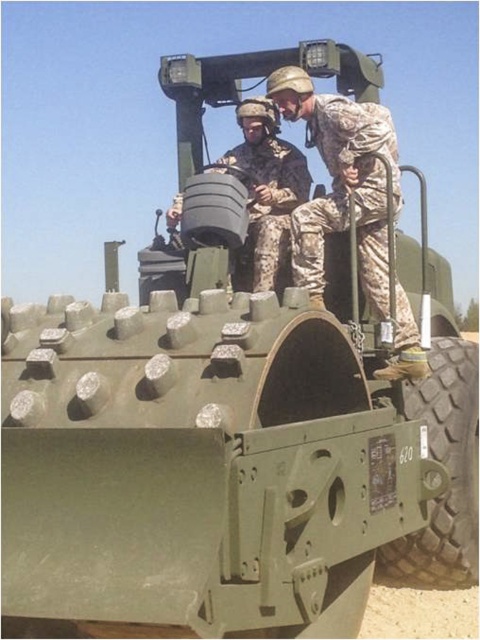
Question: Which object appears farthest from the camera in this image?

Choices:
 (A) camouflage fabric uniform at center
 (B) rubber tread tire at lower right
 (C) camouflage fabric helmet at upper center

Answer: (C)

Question: Estimate the real-world distances between objects in this image. Which object is closer to the rubber tread tire at lower right?

Choices:
 (A) camouflage fabric helmet at upper center
 (B) camouflage fabric uniform at center

Answer: (B)

Question: Which object is farther from the camera taking this photo?

Choices:
 (A) camouflage fabric helmet at upper center
 (B) camouflage fabric uniform at center
 (C) rubber tread tire at lower right

Answer: (A)

Question: Does camouflage fabric uniform at center appear under rubber tread tire at lower right?

Choices:
 (A) no
 (B) yes

Answer: (A)

Question: Is camouflage fabric uniform at center below rubber tread tire at lower right?

Choices:
 (A) no
 (B) yes

Answer: (A)

Question: Considering the relative positions of rubber tread tire at lower right and camouflage fabric helmet at upper center in the image provided, where is rubber tread tire at lower right located with respect to camouflage fabric helmet at upper center?

Choices:
 (A) below
 (B) above

Answer: (A)